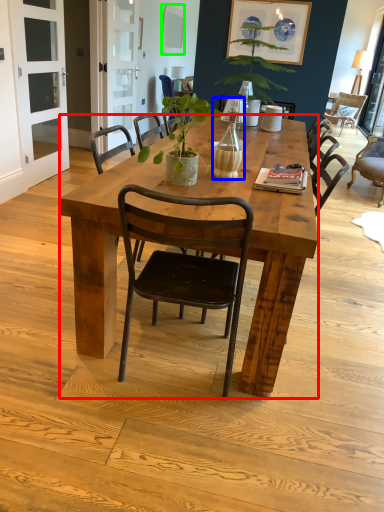
Question: Which object is the closest to the desk (highlighted by a red box)? Choose among these: bottle (highlighted by a blue box) or picture frame (highlighted by a green box).

Choices:
 (A) bottle
 (B) picture frame

Answer: (A)